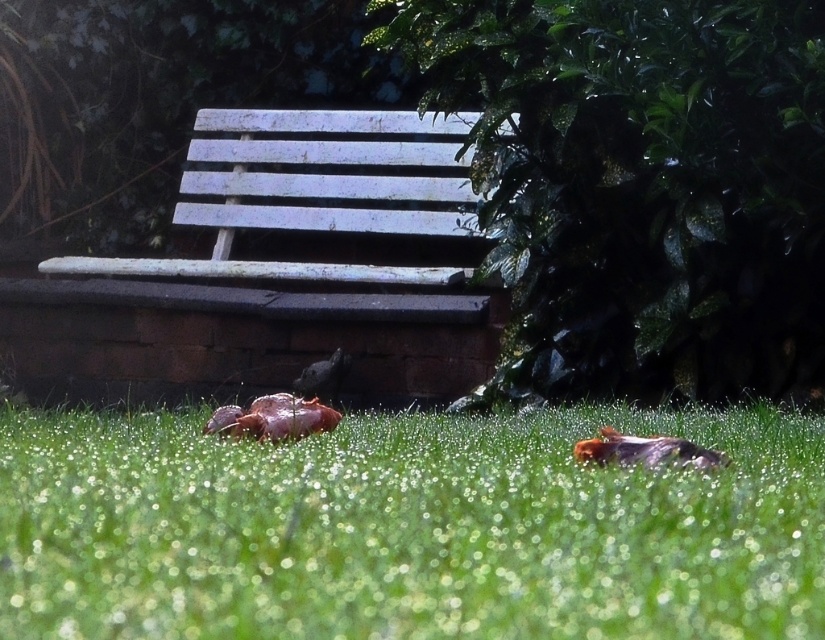
Between green grassy at lower center and shiny black bird at center, which one has more height?

Standing taller between the two is shiny black bird at center.

Based on the photo, who is lower down, green grassy at lower center or shiny black bird at center?

Positioned lower is green grassy at lower center.

Which is in front, point (748, 486) or point (328, 371)?

Positioned in front is point (748, 486).

Where is `green grassy at lower center`? green grassy at lower center is located at coordinates (408, 528).

Which is more to the left, white painted wood bench at upper center or shiny brown bird at center?

From the viewer's perspective, white painted wood bench at upper center appears more on the left side.

Is white painted wood bench at upper center taller than shiny brown bird at center?

Yes.

Between point (328, 269) and point (248, 413), which one is positioned in front?

Positioned in front is point (248, 413).

Find the location of `white painted wood bench at upper center`. white painted wood bench at upper center is located at coordinates (318, 241).

Which is below, white painted wood bench at upper center or brown speckled feathers at lower center?

brown speckled feathers at lower center is below.

Between point (225, 173) and point (681, 451), which one is positioned behind?

The point (225, 173) is more distant.

Identify the location of white painted wood bench at upper center. (318, 241).